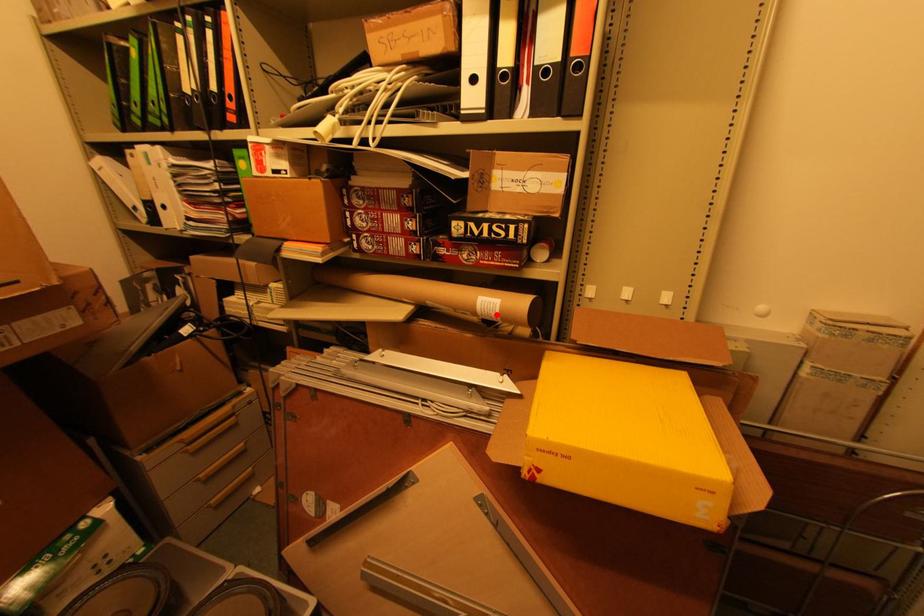
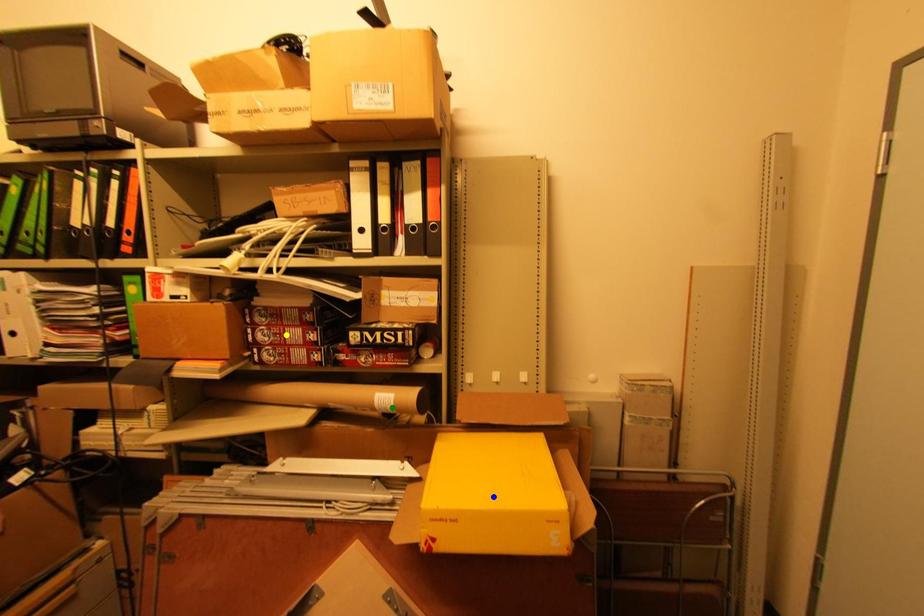
Question: I am providing you with two images of the same scene from different viewpoints. A red point is marked on the first image. You are given multiple points on the second image. Which point in image 2 represents the same 3d spot as the red point in image 1?

Choices:
 (A) green point
 (B) blue point
 (C) yellow point

Answer: (A)